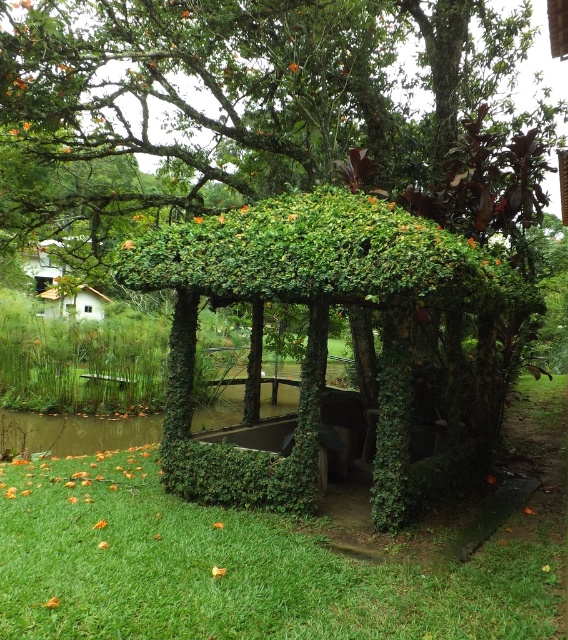
Question: Is green grass at lower left positioned behind green leafy gazebo at center?

Choices:
 (A) no
 (B) yes

Answer: (A)

Question: Among these objects, which one is farthest from the camera?

Choices:
 (A) green leafy gazebo at center
 (B) green grass at lower left

Answer: (A)

Question: Which of the following is the closest to the observer?

Choices:
 (A) (x=318, y=298)
 (B) (x=12, y=509)

Answer: (B)

Question: Can you confirm if green grass at lower left is bigger than green leafy gazebo at center?

Choices:
 (A) yes
 (B) no

Answer: (B)

Question: Can you confirm if green grass at lower left is positioned below green leafy gazebo at center?

Choices:
 (A) yes
 (B) no

Answer: (A)